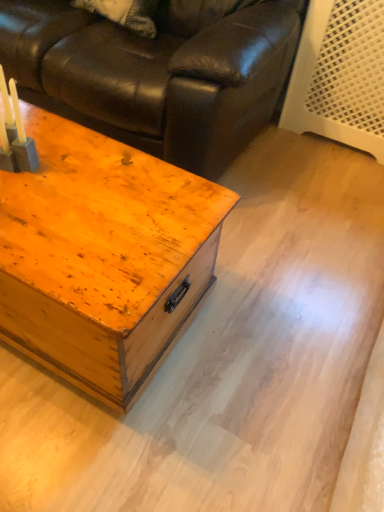
The width and height of the screenshot is (384, 512). I want to click on wooden trunk at center, so tap(103, 256).

This screenshot has width=384, height=512. I want to click on matte gray candle holder at left, so click(15, 134).

At what (x,y) coordinates should I click in order to perform the action: click on matte black leather couch at upper left. Please return your answer as a coordinate pair (x, y). Image resolution: width=384 pixels, height=512 pixels. Looking at the image, I should click on (157, 73).

Based on the photo, from a real-world perspective, which object stands above the other?

matte gray candle holder at left.

Is the surface of matte gray candle holder at left in direct contact with wooden trunk at center?

They are not placed beside each other.

Is point (17, 109) closer to camera compared to point (75, 233)?

No.

Is point (76, 328) in front of point (12, 160)?

Yes, point (76, 328) is in front of point (12, 160).

Is wooden trunk at center positioned behind matte gray candle holder at left?

No, it is in front of matte gray candle holder at left.

Can you confirm if wooden trunk at center is taller than matte gray candle holder at left?

Indeed, wooden trunk at center has a greater height compared to matte gray candle holder at left.

Is wooden trunk at center positioned beyond the bounds of matte gray candle holder at left?

wooden trunk at center lies outside matte gray candle holder at left's area.

Which object is more forward, matte black leather couch at upper left or wooden trunk at center?

wooden trunk at center is closer to the camera.

Image resolution: width=384 pixels, height=512 pixels. What are the coordinates of `studio couch above the wooden trunk at center (from a real-world perspective)` in the screenshot? It's located at (157, 73).

Considering the sizes of objects matte black leather couch at upper left and wooden trunk at center in the image provided, who is taller, matte black leather couch at upper left or wooden trunk at center?

matte black leather couch at upper left is taller.

From a real-world perspective, is matte black leather couch at upper left physically located above or below wooden trunk at center?

From a real-world perspective, matte black leather couch at upper left is physically above wooden trunk at center.

Find the location of a particular element. candle holder above the matte black leather couch at upper left (from a real-world perspective) is located at coordinates (15, 134).

Considering their positions, is matte gray candle holder at left located in front of or behind matte black leather couch at upper left?

matte gray candle holder at left is positioned closer to the viewer than matte black leather couch at upper left.

Can matte black leather couch at upper left be found inside matte gray candle holder at left?

No, matte black leather couch at upper left is not inside matte gray candle holder at left.

Where is `studio couch behind the wooden trunk at center`? This screenshot has height=512, width=384. studio couch behind the wooden trunk at center is located at coordinates (157, 73).

Can you confirm if wooden trunk at center is bigger than matte black leather couch at upper left?

No.

Is wooden trunk at center with matte black leather couch at upper left?

No.

From the picture: Measure the distance from wooden trunk at center to matte black leather couch at upper left.

They are 24.99 inches apart.

Identify the location of studio couch behind the matte gray candle holder at left. This screenshot has height=512, width=384. (157, 73).

Is matte black leather couch at upper left not within matte gray candle holder at left?

Indeed, matte black leather couch at upper left is completely outside matte gray candle holder at left.

Is matte black leather couch at upper left to the left of matte gray candle holder at left from the viewer's perspective?

In fact, matte black leather couch at upper left is to the right of matte gray candle holder at left.

Who is taller, matte black leather couch at upper left or matte gray candle holder at left?

Standing taller between the two is matte black leather couch at upper left.

At what (x,y) coordinates should I click in order to perform the action: click on candle holder on the right of wooden trunk at center. Please return your answer as a coordinate pair (x, y). The width and height of the screenshot is (384, 512). Looking at the image, I should click on (15, 134).

The width and height of the screenshot is (384, 512). In order to click on candle holder above the wooden trunk at center (from the image's perspective) in this screenshot , I will do `click(15, 134)`.

Estimate the real-world distances between objects in this image. Which object is closer to matte black leather couch at upper left, wooden trunk at center or matte gray candle holder at left?

wooden trunk at center is closer to matte black leather couch at upper left.

Considering their positions, is matte gray candle holder at left positioned further to wooden trunk at center than matte black leather couch at upper left?

Based on the image, matte black leather couch at upper left appears to be further to wooden trunk at center.

When comparing their distances from matte gray candle holder at left, does matte black leather couch at upper left or wooden trunk at center seem closer?

A: The object closer to matte gray candle holder at left is wooden trunk at center.

From the image, which object appears to be nearer to matte black leather couch at upper left, matte gray candle holder at left or wooden trunk at center?

wooden trunk at center is closer to matte black leather couch at upper left.

Looking at the image, which one is located closer to matte gray candle holder at left, wooden trunk at center or matte black leather couch at upper left?

Among the two, wooden trunk at center is located nearer to matte gray candle holder at left.

Considering their positions, is matte black leather couch at upper left positioned further to wooden trunk at center than matte gray candle holder at left?

Based on the image, matte black leather couch at upper left appears to be further to wooden trunk at center.

Find the location of a particular element. candle holder between matte black leather couch at upper left and wooden trunk at center in the up-down direction is located at coordinates (15, 134).